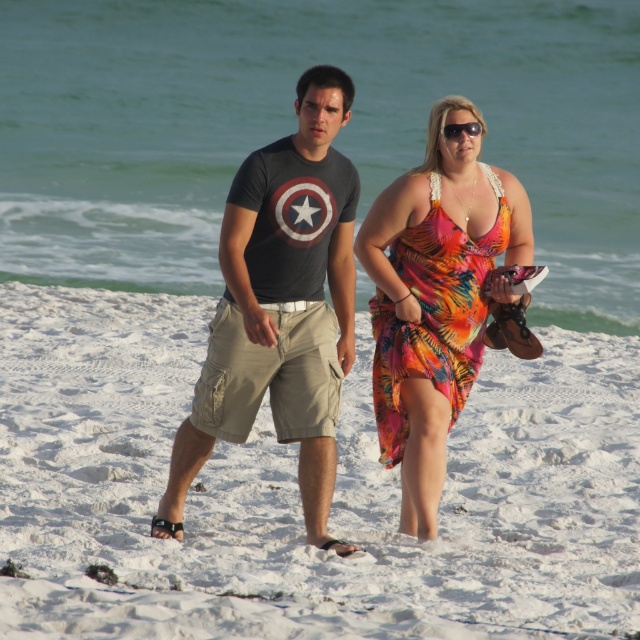
Between point (435, 275) and point (454, 134), which one is positioned behind?

The point (435, 275) is more distant.

Which is more to the left, fuzzy tropical wrap at center or sunglasses at upper center?

fuzzy tropical wrap at center

The width and height of the screenshot is (640, 640). Find the location of `fuzzy tropical wrap at center`. fuzzy tropical wrap at center is located at coordinates (433, 314).

In the scene shown: Who is shorter, dark gray t-shirt at center or fuzzy tropical wrap at center?

fuzzy tropical wrap at center

Does dark gray t-shirt at center appear on the right side of fuzzy tropical wrap at center?

No, dark gray t-shirt at center is not to the right of fuzzy tropical wrap at center.

Identify the location of dark gray t-shirt at center. The height and width of the screenshot is (640, 640). (280, 307).

In the scene shown: Does white sandy beach at center have a smaller size compared to sunglasses at upper center?

Actually, white sandy beach at center might be larger than sunglasses at upper center.

Is white sandy beach at center above sunglasses at upper center?

No, white sandy beach at center is not above sunglasses at upper center.

Where is `white sandy beach at center`? white sandy beach at center is located at coordinates (298, 492).

Where is `white sandy beach at center`? This screenshot has width=640, height=640. white sandy beach at center is located at coordinates (298, 492).